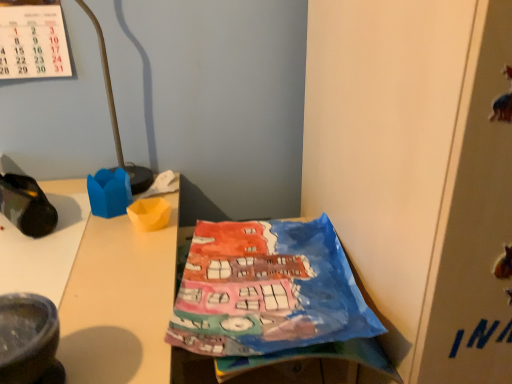
Identify the location of camouflage fabric shoe at left. (26, 205).

Identify the location of watercolor paper at center. This screenshot has height=384, width=512. (267, 290).

Is watercolor paper at center bigger or smaller than metallic gold lamp at upper left?

watercolor paper at center is bigger than metallic gold lamp at upper left.

From the image's perspective, is watercolor paper at center on top of metallic gold lamp at upper left?

No, from the image's perspective, watercolor paper at center is not on top of metallic gold lamp at upper left.

Consider the image. Are watercolor paper at center and metallic gold lamp at upper left beside each other?

No.

Where is `footwear behind the watercolor paper at center`? footwear behind the watercolor paper at center is located at coordinates (26, 205).

Is watercolor paper at center turned away from camouflage fabric shoe at left?

No, watercolor paper at center is not facing away from camouflage fabric shoe at left.

Which is behind, watercolor paper at center or camouflage fabric shoe at left?

camouflage fabric shoe at left is further from the camera.

Is metallic gold lamp at upper left looking in the opposite direction of camouflage fabric shoe at left?

No, metallic gold lamp at upper left is not facing away from camouflage fabric shoe at left.

Can you tell me how much metallic gold lamp at upper left and camouflage fabric shoe at left differ in facing direction?

The angular difference between metallic gold lamp at upper left and camouflage fabric shoe at left is 69.3 degrees.

Is metallic gold lamp at upper left taller than camouflage fabric shoe at left?

Yes.

Would you say metallic gold lamp at upper left contains camouflage fabric shoe at left?

Definitely not — camouflage fabric shoe at left is not inside metallic gold lamp at upper left.

Is camouflage fabric shoe at left to the left of metallic gold lamp at upper left from the viewer's perspective?

Yes.

Is camouflage fabric shoe at left spatially inside metallic gold lamp at upper left, or outside of it?

camouflage fabric shoe at left is spatially situated outside metallic gold lamp at upper left.

Who is bigger, camouflage fabric shoe at left or metallic gold lamp at upper left?

metallic gold lamp at upper left.

Is camouflage fabric shoe at left shorter than watercolor paper at center?

Correct, camouflage fabric shoe at left is not as tall as watercolor paper at center.

You are a GUI agent. You are given a task and a screenshot of the screen. Output one action in this format:
    pyautogui.click(x=<x>, y=<y>)
    Task: Click on the wrapping paper to the right of camouflage fabric shoe at left
    The width and height of the screenshot is (512, 384).
    Given the screenshot: What is the action you would take?
    pyautogui.click(x=267, y=290)

Is camouflage fabric shoe at left not near watercolor paper at center?

camouflage fabric shoe at left is near watercolor paper at center, not far away.

Consider the image. Considering the sizes of camouflage fabric shoe at left and watercolor paper at center in the image, is camouflage fabric shoe at left bigger or smaller than watercolor paper at center?

Considering their sizes, camouflage fabric shoe at left takes up less space than watercolor paper at center.

Is watercolor paper at center located within metallic gold lamp at upper left?

No, watercolor paper at center is not surrounded by metallic gold lamp at upper left.

Is metallic gold lamp at upper left touching watercolor paper at center?

There is a gap between metallic gold lamp at upper left and watercolor paper at center.

From a real-world perspective, is metallic gold lamp at upper left located beneath watercolor paper at center?

No, from a real-world perspective, metallic gold lamp at upper left is not below watercolor paper at center.

From the image's perspective, is metallic gold lamp at upper left located beneath watercolor paper at center?

No, from the image's perspective, metallic gold lamp at upper left is not beneath watercolor paper at center.

This screenshot has width=512, height=384. I want to click on wrapping paper below the metallic gold lamp at upper left (from a real-world perspective), so (x=267, y=290).

I want to click on wrapping paper in front of the camouflage fabric shoe at left, so [267, 290].

When comparing their distances from metallic gold lamp at upper left, does watercolor paper at center or camouflage fabric shoe at left seem further?

watercolor paper at center is positioned further to the anchor metallic gold lamp at upper left.

From the image, which object appears to be farther from camouflage fabric shoe at left, watercolor paper at center or metallic gold lamp at upper left?

The object further to camouflage fabric shoe at left is watercolor paper at center.

Estimate the real-world distances between objects in this image. Which object is closer to metallic gold lamp at upper left, camouflage fabric shoe at left or watercolor paper at center?

The object closer to metallic gold lamp at upper left is camouflage fabric shoe at left.

From the image, which object appears to be nearer to watercolor paper at center, camouflage fabric shoe at left or metallic gold lamp at upper left?

Based on the image, camouflage fabric shoe at left appears to be nearer to watercolor paper at center.

Which object lies nearer to the anchor point watercolor paper at center, metallic gold lamp at upper left or camouflage fabric shoe at left?

Among the two, camouflage fabric shoe at left is located nearer to watercolor paper at center.

Considering their positions, is metallic gold lamp at upper left positioned closer to camouflage fabric shoe at left than watercolor paper at center?

Among the two, metallic gold lamp at upper left is located nearer to camouflage fabric shoe at left.

The image size is (512, 384). In order to click on footwear between metallic gold lamp at upper left and watercolor paper at center from top to bottom in this screenshot , I will do `click(26, 205)`.